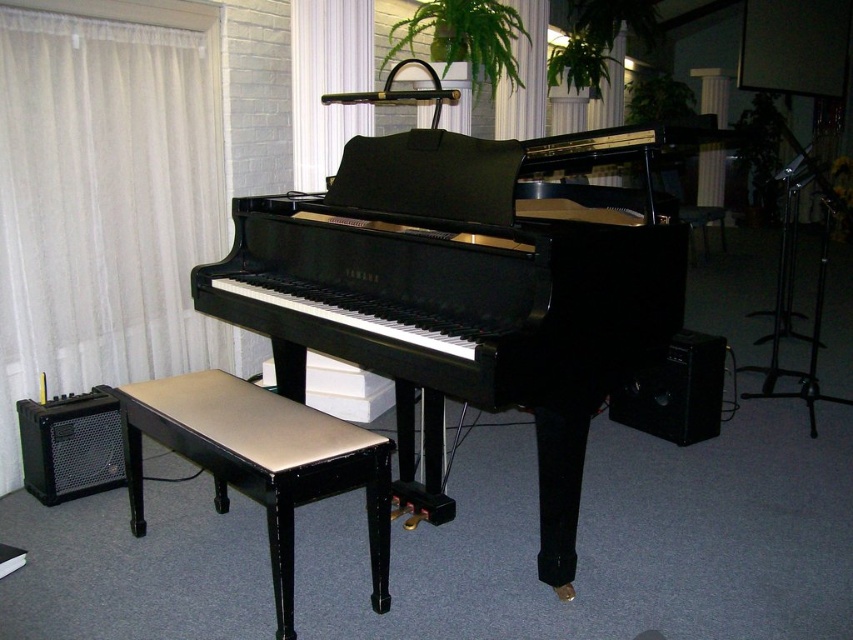
You are a piano teacher standing at the center of the room. You want to move the black mesh speaker at lower left to the right side of the piano. What is the coordinate of the new position if you move it 0.1 units to the right along the X axis?

The new coordinate would be at point X 0.797, Y 0.083.

In the scene shown: You are a piano student who needs to sit on the matte black music stool at center. Based on the coordinates provided, where exactly should you position yourself relative to the piano and the amplifiers?

The matte black music stool at center is located at coordinates point (260, 461), which places it directly in front of the piano between the two amplifiers on either side.